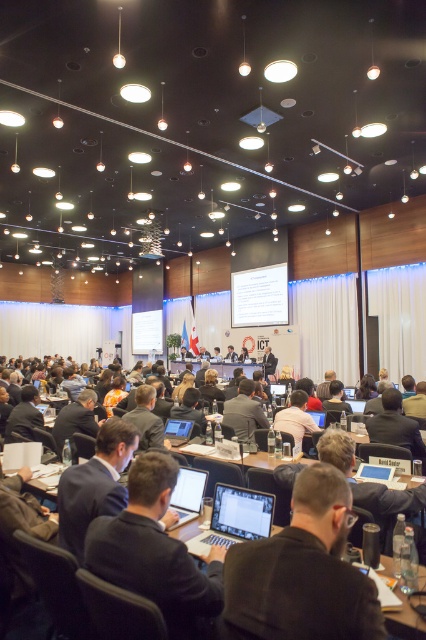
Is black matte laptop at center to the right of dark brown suit at center from the viewer's perspective?

In fact, black matte laptop at center is to the left of dark brown suit at center.

Does black matte laptop at center come in front of dark brown suit at center?

Yes, it is.

Between point (273, 572) and point (411, 435), which one is positioned in front?

Point (273, 572) is in front.

Locate an element on the screen. This screenshot has width=426, height=640. black matte laptop at center is located at coordinates (302, 572).

Locate an element on the screen. This screenshot has width=426, height=640. black matte laptop at center is located at coordinates (302, 572).

Can you confirm if black matte laptop at center is positioned below dark suit at lower left?

No, black matte laptop at center is not below dark suit at lower left.

Measure the distance between point (299, 579) and camera.

They are 1.16 meters apart.

This screenshot has width=426, height=640. I want to click on black matte laptop at center, so click(302, 572).

Does black matte laptop at center have a lesser width compared to dark blue suit at center?

Indeed, black matte laptop at center has a lesser width compared to dark blue suit at center.

Which is above, black matte laptop at center or dark blue suit at center?

Positioned higher is black matte laptop at center.

Consider the image. Who is more distant from viewer, (310,486) or (169,600)?

The point (169,600) is more distant.

What are the coordinates of `black matte laptop at center` in the screenshot? It's located at (302, 572).